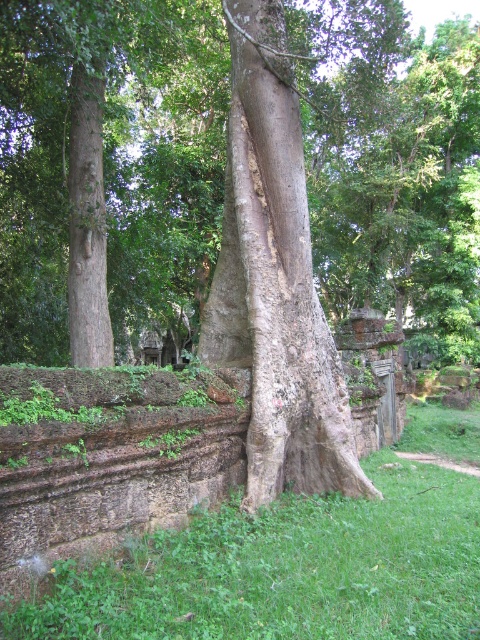
Question: Is smooth gray tree trunk at center to the right of green grass at lower center from the viewer's perspective?

Choices:
 (A) yes
 (B) no

Answer: (B)

Question: Estimate the real-world distances between objects in this image. Which object is closer to the green grass at lower center?

Choices:
 (A) gray rough tree trunk at center
 (B) smooth brown tree trunk at left

Answer: (A)

Question: Where is green grass at lower center located in relation to gray rough tree trunk at center in the image?

Choices:
 (A) right
 (B) left

Answer: (A)

Question: Can you confirm if gray rough tree trunk at center is bigger than smooth brown tree trunk at left?

Choices:
 (A) no
 (B) yes

Answer: (B)

Question: Which object is closer to the camera taking this photo?

Choices:
 (A) green grass at lower center
 (B) smooth gray tree trunk at center

Answer: (A)

Question: Estimate the real-world distances between objects in this image. Which object is closer to the smooth brown tree trunk at left?

Choices:
 (A) gray rough tree trunk at center
 (B) green grass at lower center
 (C) smooth gray tree trunk at center

Answer: (A)